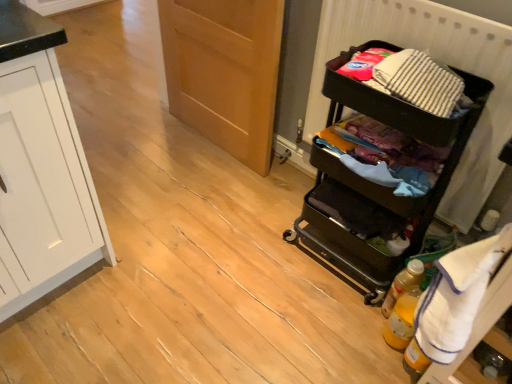
You are a GUI agent. You are given a task and a screenshot of the screen. Output one action in this format:
    pyautogui.click(x=<x>, y=<y>)
    Task: Click on the free space to the back side of translucent yellow bottle at lower right, placed as the first bottle when sorted from front to back
    
    Given the screenshot: What is the action you would take?
    pyautogui.click(x=362, y=297)